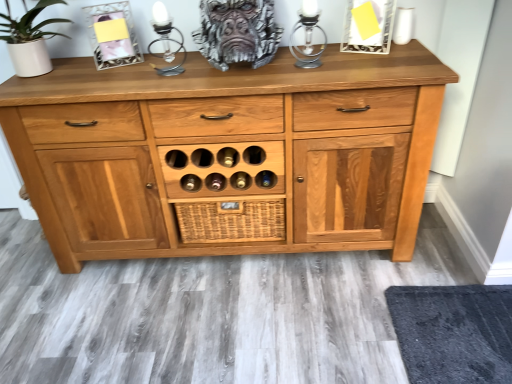
Question: Could you tell me if silver metallic candle holder at upper center, the second candle holder viewed from the left, is facing woven brown basket at center?

Choices:
 (A) yes
 (B) no

Answer: (B)

Question: Considering the relative positions of silver metallic candle holder at upper center, the second candle holder viewed from the left, and woven brown basket at center in the image provided, is silver metallic candle holder at upper center, the second candle holder viewed from the left, to the right of woven brown basket at center from the viewer's perspective?

Choices:
 (A) no
 (B) yes

Answer: (B)

Question: Is silver metallic candle holder at upper center, the second candle holder viewed from the left, closer to the viewer compared to woven brown basket at center?

Choices:
 (A) no
 (B) yes

Answer: (B)

Question: From the image's perspective, is silver metallic candle holder at upper center, the first candle holder viewed from the right, on top of woven brown basket at center?

Choices:
 (A) yes
 (B) no

Answer: (A)

Question: Does silver metallic candle holder at upper center, the first candle holder viewed from the right, have a lesser width compared to woven brown basket at center?

Choices:
 (A) no
 (B) yes

Answer: (A)

Question: Considering the positions of black textured mat at lower right and woven brown basket at center in the image, is black textured mat at lower right wider or thinner than woven brown basket at center?

Choices:
 (A) thin
 (B) wide

Answer: (B)

Question: Based on their positions, is black textured mat at lower right located to the left or right of woven brown basket at center?

Choices:
 (A) right
 (B) left

Answer: (A)

Question: Is black textured mat at lower right taller or shorter than woven brown basket at center?

Choices:
 (A) tall
 (B) short

Answer: (B)

Question: Do you think black textured mat at lower right is within woven brown basket at center, or outside of it?

Choices:
 (A) outside
 (B) inside

Answer: (A)

Question: Looking at the image, does silver metallic candle holder at upper center, the first candle holder viewed from the right, seem bigger or smaller compared to black textured mat at lower right?

Choices:
 (A) big
 (B) small

Answer: (B)

Question: Is point (317, 16) closer or farther from the camera than point (507, 304)?

Choices:
 (A) farther
 (B) closer

Answer: (A)

Question: From the image's perspective, is silver metallic candle holder at upper center, the second candle holder viewed from the left, above or below black textured mat at lower right?

Choices:
 (A) above
 (B) below

Answer: (A)

Question: Considering the positions of silver metallic candle holder at upper center, the second candle holder viewed from the left, and black textured mat at lower right in the image, is silver metallic candle holder at upper center, the second candle holder viewed from the left, taller or shorter than black textured mat at lower right?

Choices:
 (A) short
 (B) tall

Answer: (B)

Question: Does point (307, 4) appear closer or farther from the camera than point (265, 228)?

Choices:
 (A) farther
 (B) closer

Answer: (B)

Question: From a real-world perspective, is silver metallic candle holder at upper center, the first candle holder viewed from the right, above or below woven brown basket at center?

Choices:
 (A) below
 (B) above

Answer: (B)